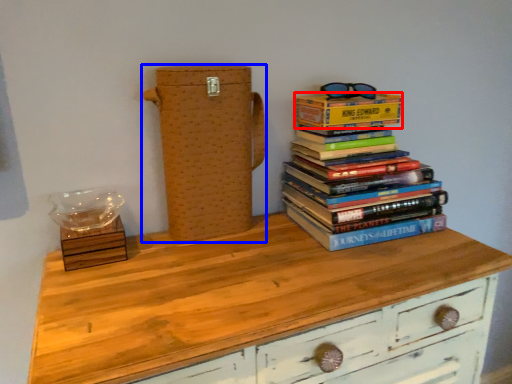
Question: Among these objects, which one is farthest to the camera, paperback book (highlighted by a red box) or cardboard box (highlighted by a blue box)?

Choices:
 (A) paperback book
 (B) cardboard box

Answer: (A)